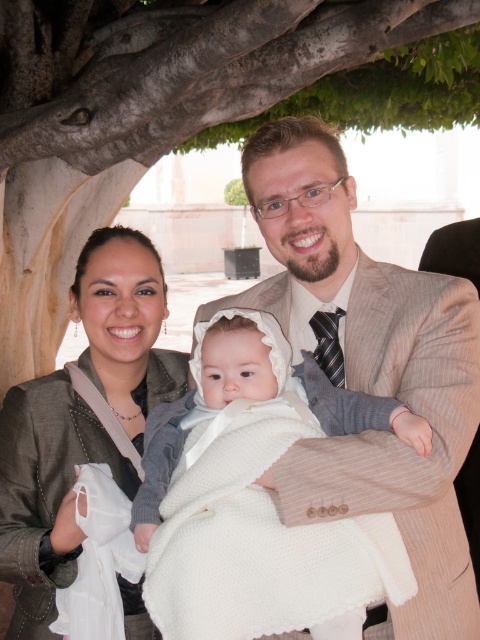
Can you confirm if light brown striped suit at center is positioned to the right of white knitted blanket at center?

Yes, light brown striped suit at center is to the right of white knitted blanket at center.

Locate an element on the screen. This screenshot has height=640, width=480. light brown striped suit at center is located at coordinates (368, 368).

Which is behind, point (313, 451) or point (339, 401)?

Point (339, 401)

This screenshot has width=480, height=640. I want to click on light brown striped suit at center, so click(x=368, y=368).

Between point (144, 548) and point (140, 435), which one is positioned behind?

The point (140, 435) is behind.

Locate an element on the screen. This screenshot has width=480, height=640. white knitted blanket at center is located at coordinates click(x=254, y=500).

Is light brown striped suit at center taller than matte gray jacket at center?

Correct, light brown striped suit at center is much taller as matte gray jacket at center.

Is point (448, 547) in front of point (72, 412)?

Yes.

Where is `light brown striped suit at center`? light brown striped suit at center is located at coordinates (368, 368).